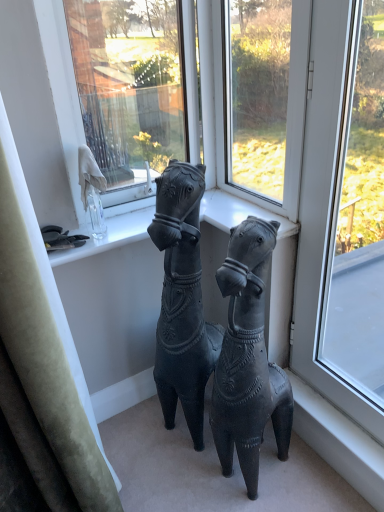
Question: From the image's perspective, is transparent glass window at center, placed as the second window when sorted from right to left, below matte black horse at center, positioned as the 2th horse in left-to-right order?

Choices:
 (A) no
 (B) yes

Answer: (A)

Question: Can you confirm if transparent glass window at center, marked as the 1th window in a left-to-right arrangement, is taller than matte black horse at center, the 1th horse from the right?

Choices:
 (A) yes
 (B) no

Answer: (B)

Question: Can you confirm if transparent glass window at center, marked as the 1th window in a left-to-right arrangement, is positioned to the right of matte black horse at center, the 1th horse from the right?

Choices:
 (A) yes
 (B) no

Answer: (A)

Question: Considering the relative positions of transparent glass window at center, marked as the 1th window in a left-to-right arrangement, and matte black horse at center, positioned as the 2th horse in left-to-right order, in the image provided, is transparent glass window at center, marked as the 1th window in a left-to-right arrangement, to the left of matte black horse at center, positioned as the 2th horse in left-to-right order, from the viewer's perspective?

Choices:
 (A) yes
 (B) no

Answer: (B)

Question: Can you confirm if transparent glass window at center, placed as the second window when sorted from right to left, is wider than matte black horse at center, positioned as the 2th horse in left-to-right order?

Choices:
 (A) no
 (B) yes

Answer: (A)

Question: Looking at their shapes, would you say transparent glass window at right, which is the second window from left to right, is wider or thinner than velvet green curtain at left?

Choices:
 (A) thin
 (B) wide

Answer: (A)

Question: Looking at the image, does transparent glass window at right, which is counted as the first window, starting from the right, seem bigger or smaller compared to velvet green curtain at left?

Choices:
 (A) small
 (B) big

Answer: (A)

Question: Is transparent glass window at right, which is the second window from left to right, inside or outside of velvet green curtain at left?

Choices:
 (A) outside
 (B) inside

Answer: (A)

Question: Visually, is transparent glass window at right, which is the second window from left to right, positioned to the left or to the right of velvet green curtain at left?

Choices:
 (A) left
 (B) right

Answer: (B)

Question: In terms of height, does matte black horse at center, acting as the 2th horse starting from the right, look taller or shorter compared to transparent glass window at right, which is the second window from left to right?

Choices:
 (A) tall
 (B) short

Answer: (B)

Question: Considering the positions of matte black horse at center, acting as the 2th horse starting from the right, and transparent glass window at right, which is the second window from left to right, in the image, is matte black horse at center, acting as the 2th horse starting from the right, wider or thinner than transparent glass window at right, which is the second window from left to right,?

Choices:
 (A) thin
 (B) wide

Answer: (B)

Question: Considering their positions, is matte black horse at center, acting as the 2th horse starting from the right, located in front of or behind transparent glass window at right, which is counted as the first window, starting from the right?

Choices:
 (A) behind
 (B) front

Answer: (A)

Question: Is matte black horse at center, acting as the 2th horse starting from the right, to the left or to the right of transparent glass window at right, which is the second window from left to right, in the image?

Choices:
 (A) left
 (B) right

Answer: (A)

Question: Considering the positions of transparent glass window at center, marked as the 1th window in a left-to-right arrangement, and transparent glass window at right, which is the second window from left to right, in the image, is transparent glass window at center, marked as the 1th window in a left-to-right arrangement, taller or shorter than transparent glass window at right, which is the second window from left to right,?

Choices:
 (A) tall
 (B) short

Answer: (B)

Question: From the image's perspective, relative to transparent glass window at right, which is counted as the first window, starting from the right, is transparent glass window at center, placed as the second window when sorted from right to left, above or below?

Choices:
 (A) below
 (B) above

Answer: (B)